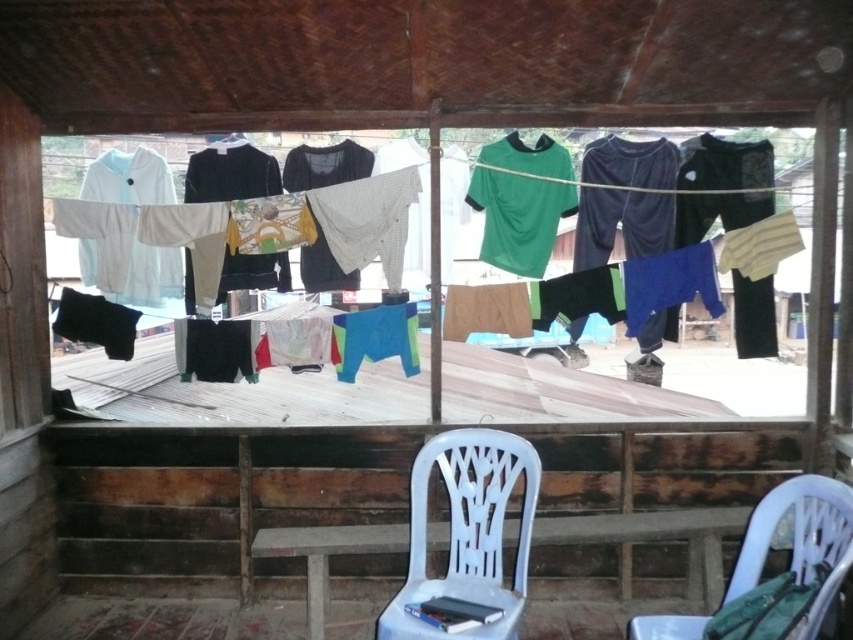
You need to place a small potted plant that is 30 cm wide between the white fabric at center and the white plastic chair at lower center. Based on the scene, will there be enough space for the plant?

The white fabric at center has a width larger than the white plastic chair at lower center. Since the plant is only 30 cm wide, there should be sufficient space between them to accommodate it.

You are a person who is 165 centimeters tall. You want to sit on one of the white plastic chairs but need to ensure there is enough space between them to stretch your legs. Given that the average leg length for someone of your height is about 75 centimeters, will the distance between the white plastic chair at lower center and white plastic chair at lower right allow you to comfortably stretch your legs between them?

The white plastic chair at lower center is 69.58 centimeters away from the white plastic chair at lower right. Since your leg length is 75 centimeters, the distance between the chairs is slightly shorter than your leg length, so it might be a bit tight but still possible to stretch your legs between them.